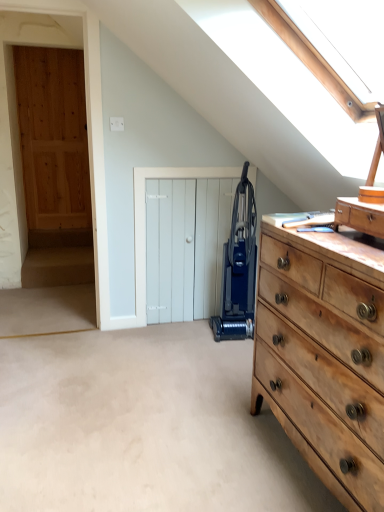
Locate an element on the screen. vacant region to the left of wooden drawer at right is located at coordinates (330, 238).